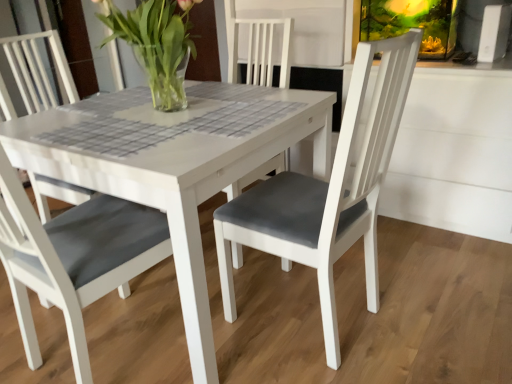
Question: Is clear glass vase at center to the right of matte gray cushion at center from the viewer's perspective?

Choices:
 (A) yes
 (B) no

Answer: (B)

Question: Could you tell me if clear glass vase at center is facing matte gray cushion at center?

Choices:
 (A) no
 (B) yes

Answer: (A)

Question: From a real-world perspective, is clear glass vase at center located higher than matte gray cushion at center?

Choices:
 (A) yes
 (B) no

Answer: (A)

Question: Is clear glass vase at center bigger than matte gray cushion at center?

Choices:
 (A) yes
 (B) no

Answer: (B)

Question: Is clear glass vase at center with matte gray cushion at center?

Choices:
 (A) no
 (B) yes

Answer: (A)

Question: Is clear glass vase at center smaller than matte gray cushion at center?

Choices:
 (A) no
 (B) yes

Answer: (B)

Question: Is matte gray cushion at center not within clear glass vase at center?

Choices:
 (A) no
 (B) yes

Answer: (B)

Question: Is matte gray cushion at center in front of clear glass vase at center?

Choices:
 (A) no
 (B) yes

Answer: (B)

Question: From the image's perspective, is matte gray cushion at center on top of clear glass vase at center?

Choices:
 (A) no
 (B) yes

Answer: (A)

Question: From the image's perspective, does matte gray cushion at center appear lower than clear glass vase at center?

Choices:
 (A) yes
 (B) no

Answer: (A)

Question: From a real-world perspective, is matte gray cushion at center below clear glass vase at center?

Choices:
 (A) no
 (B) yes

Answer: (B)

Question: Is matte gray cushion at center smaller than clear glass vase at center?

Choices:
 (A) no
 (B) yes

Answer: (A)

Question: From the image's perspective, relative to clear glass vase at center, is matte gray cushion at center above or below?

Choices:
 (A) below
 (B) above

Answer: (A)